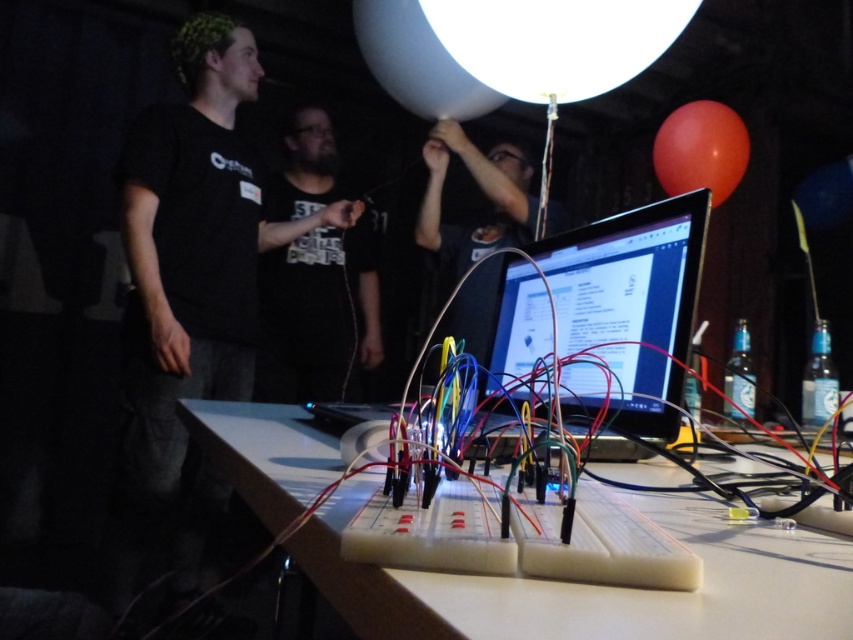
Is point (589, 404) positioned behind point (428, 97)?

That is False.

Which is behind, point (508, 282) or point (404, 65)?

Point (404, 65)

Image resolution: width=853 pixels, height=640 pixels. Describe the element at coordinates (631, 301) in the screenshot. I see `black glossy monitor at center` at that location.

I want to click on black glossy monitor at center, so click(631, 301).

Is black matte t-shirt at center below white glossy balloon at upper center?

Yes, black matte t-shirt at center is below white glossy balloon at upper center.

Find the location of `black matte t-shirt at center`. black matte t-shirt at center is located at coordinates (317, 314).

Is black glossy monitor at center shorter than rubber balloon at upper right?

Yes, black glossy monitor at center is shorter than rubber balloon at upper right.

Does black glossy monitor at center appear on the right side of rubber balloon at upper right?

No, black glossy monitor at center is not to the right of rubber balloon at upper right.

Which is in front, point (508, 376) or point (737, 172)?

Point (508, 376) is more forward.

The height and width of the screenshot is (640, 853). In order to click on black glossy monitor at center in this screenshot , I will do [x=631, y=301].